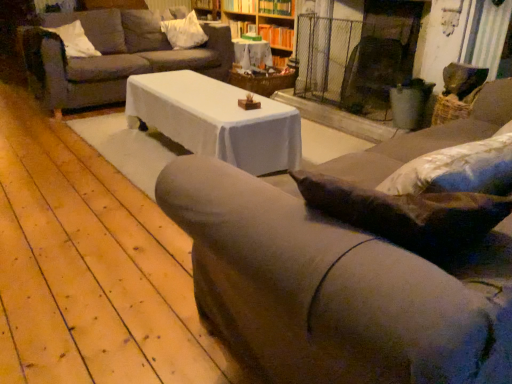
Question: From a real-world perspective, is wooden bookshelf at upper center physically located above or below wooden bookshelf at upper center, marked as the second shelf in a top-to-bottom arrangement?

Choices:
 (A) below
 (B) above

Answer: (A)

Question: Based on their positions, is wooden bookshelf at upper center located to the left or right of wooden bookshelf at upper center, marked as the second shelf in a top-to-bottom arrangement?

Choices:
 (A) right
 (B) left

Answer: (B)

Question: Which is nearer to the white soft pillow at upper left, acting as the 1th pillow starting from the front?

Choices:
 (A) wooden bookshelf at upper center
 (B) velvet brown couch at center, the first studio couch when ordered from right to left
 (C) wooden bookshelf at upper center, marked as the first shelf in a top-to-bottom arrangement
 (D) dark brown leather swivel chair at center
 (E) wooden bookshelf at upper center, the 1th shelf from the bottom

Answer: (A)

Question: Estimate the real-world distances between objects in this image. Which object is farther from the velvet blue couch at upper left, the 2th studio couch viewed from the right?

Choices:
 (A) white fabric pillow at upper center, marked as the 1th pillow in a right-to-left arrangement
 (B) white soft pillow at upper left, acting as the 1th pillow starting from the front
 (C) wooden bookshelf at upper center, the second shelf ordered from the bottom
 (D) wooden textured table at center
 (E) wooden bookshelf at upper center, marked as the second shelf in a top-to-bottom arrangement

Answer: (C)